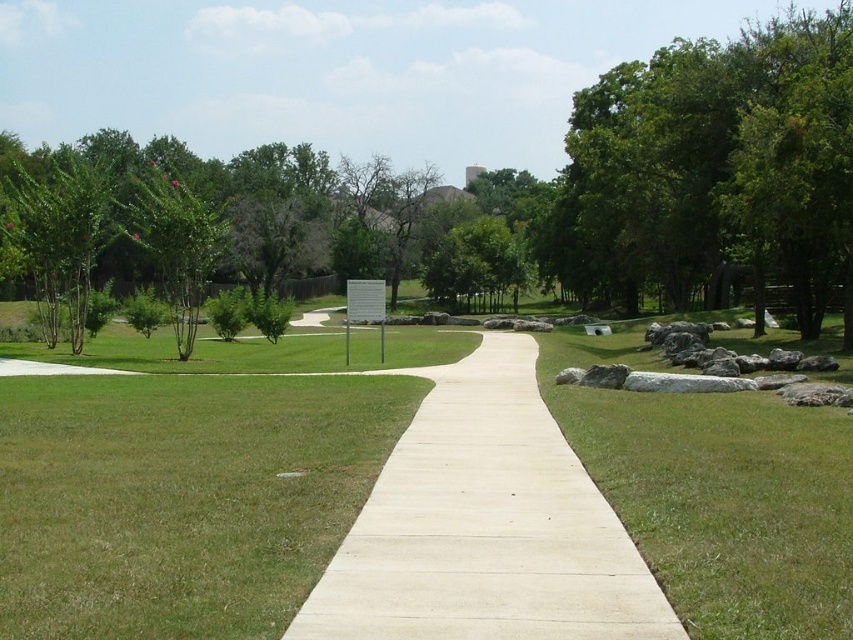
Is green leafy tree at upper right wider than green leafy tree at left?

Indeed, green leafy tree at upper right has a greater width compared to green leafy tree at left.

Is green leafy tree at upper right taller than green leafy tree at left?

Yes, green leafy tree at upper right is taller than green leafy tree at left.

This screenshot has width=853, height=640. What do you see at coordinates (712, 170) in the screenshot?
I see `green leafy tree at upper right` at bounding box center [712, 170].

Locate an element on the screen. This screenshot has height=640, width=853. green leafy tree at upper right is located at coordinates (712, 170).

Can you confirm if green leafy tree at upper right is positioned to the right of white concrete pavement at center?

Yes, green leafy tree at upper right is to the right of white concrete pavement at center.

Consider the image. Does green leafy tree at upper right come behind white concrete pavement at center?

Yes, it is behind white concrete pavement at center.

What do you see at coordinates (712, 170) in the screenshot? The width and height of the screenshot is (853, 640). I see `green leafy tree at upper right` at bounding box center [712, 170].

In order to click on green leafy tree at upper right in this screenshot , I will do `click(712, 170)`.

Between white concrete pavement at center and green leafy tree at left, which one appears on the left side from the viewer's perspective?

green leafy tree at left is more to the left.

Between white concrete pavement at center and green leafy tree at left, which one appears on the right side from the viewer's perspective?

white concrete pavement at center

Measure the distance between white concrete pavement at center and camera.

They are 4.81 meters apart.

You are a GUI agent. You are given a task and a screenshot of the screen. Output one action in this format:
    pyautogui.click(x=<x>, y=<y>)
    Task: Click on the white concrete pavement at center
    
    Given the screenshot: What is the action you would take?
    pyautogui.click(x=485, y=525)